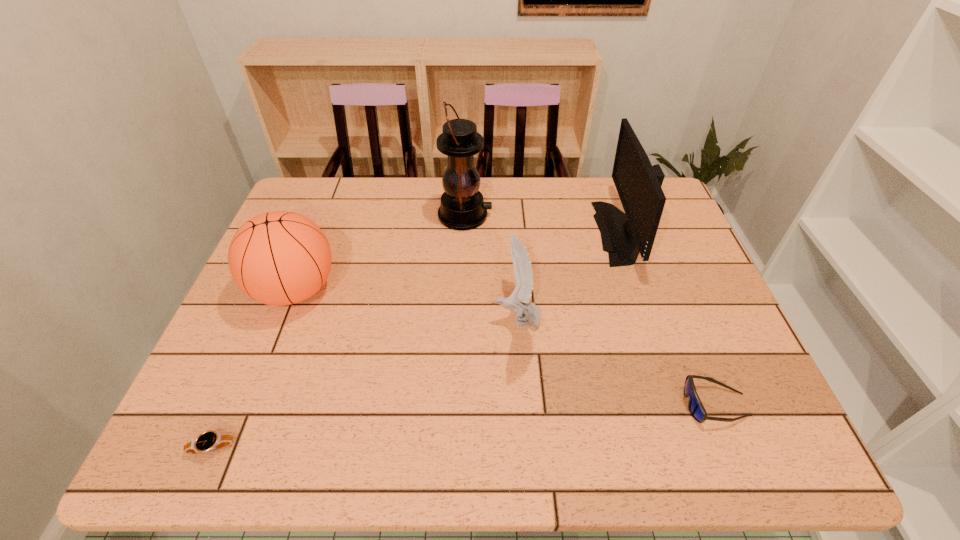
Locate an element on the screen. This screenshot has height=540, width=960. object present at the near right corner is located at coordinates (695, 406).

Locate an element on the screen. free region at the far edge of the desktop is located at coordinates (523, 199).

Where is `vacant space at the near edge of the desktop`? This screenshot has height=540, width=960. vacant space at the near edge of the desktop is located at coordinates (538, 429).

Find the location of a particular element. free space at the right edge of the desktop is located at coordinates click(669, 272).

Where is `vacant space at the far left corner of the desktop`? The image size is (960, 540). vacant space at the far left corner of the desktop is located at coordinates (318, 198).

Locate an element on the screen. Image resolution: width=960 pixels, height=540 pixels. vacant space at the near right corner is located at coordinates (753, 434).

You are a GUI agent. You are given a task and a screenshot of the screen. Output one action in this format:
    pyautogui.click(x=<x>, y=<y>)
    Task: Click on the free space between the basketball and the gull
    This screenshot has width=960, height=540.
    Given the screenshot: What is the action you would take?
    pyautogui.click(x=406, y=305)

Find the location of a particular element. Image resolution: width=960 pixels, height=540 pixels. unoccupied position between the second shortest object and the lantern is located at coordinates (590, 310).

This screenshot has height=540, width=960. Find the location of `free space between the second nearest object and the second tallest object`. free space between the second nearest object and the second tallest object is located at coordinates (670, 319).

Locate an element on the screen. This screenshot has width=960, height=540. empty space that is in between the sunglasses and the basketball is located at coordinates (505, 347).